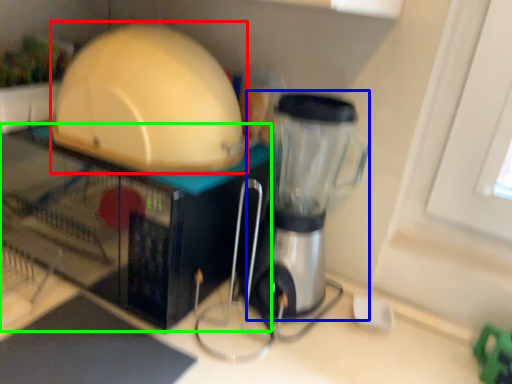
Question: Based on their relative distances, which object is farther from appliance (highlighted by a red box)? Choose from blender (highlighted by a blue box) and appliance (highlighted by a green box).

Choices:
 (A) blender
 (B) appliance

Answer: (A)